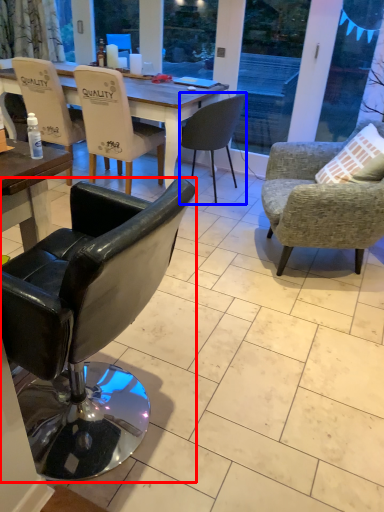
Question: Which object is closer to the camera taking this photo, chair (highlighted by a red box) or chair (highlighted by a blue box)?

Choices:
 (A) chair
 (B) chair

Answer: (A)